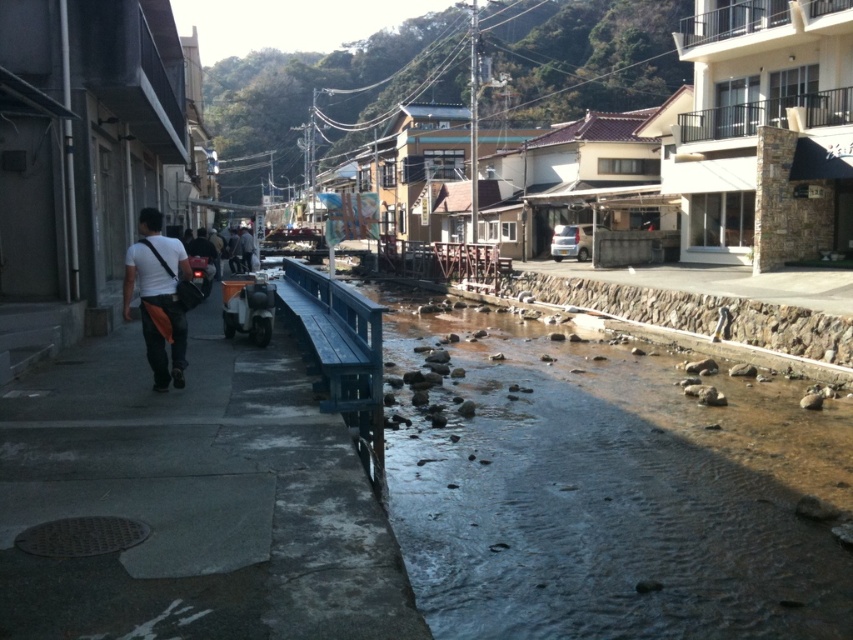
This screenshot has width=853, height=640. What do you see at coordinates (610, 493) in the screenshot? I see `clear water at center` at bounding box center [610, 493].

Who is more forward, (660, 561) or (248, 388)?

Point (660, 561) is more forward.

Which is behind, point (572, 556) or point (85, 440)?

The point (85, 440) is more distant.

Image resolution: width=853 pixels, height=640 pixels. Find the location of `clear water at center`. clear water at center is located at coordinates (610, 493).

How far apart are matte black bag at left and dark gray fabric jacket at center?

matte black bag at left is 21.15 meters from dark gray fabric jacket at center.

Is matte black bag at left smaller than dark gray fabric jacket at center?

Correct, matte black bag at left occupies less space than dark gray fabric jacket at center.

Is point (169, 340) more distant than point (248, 234)?

No, (169, 340) is closer to viewer.

You are a GUI agent. You are given a task and a screenshot of the screen. Output one action in this format:
    pyautogui.click(x=<x>, y=<y>)
    Task: Click on the matte black bag at left
    
    Given the screenshot: What is the action you would take?
    pyautogui.click(x=158, y=298)

Consider the image. Is clear water at center above dark gray fabric jacket at center?

Incorrect, clear water at center is not positioned above dark gray fabric jacket at center.

Can you confirm if clear water at center is positioned to the right of dark gray fabric jacket at center?

Correct, you'll find clear water at center to the right of dark gray fabric jacket at center.

Does point (665, 538) come in front of point (250, 257)?

Yes, point (665, 538) is closer to viewer.

The image size is (853, 640). I want to click on clear water at center, so click(x=610, y=493).